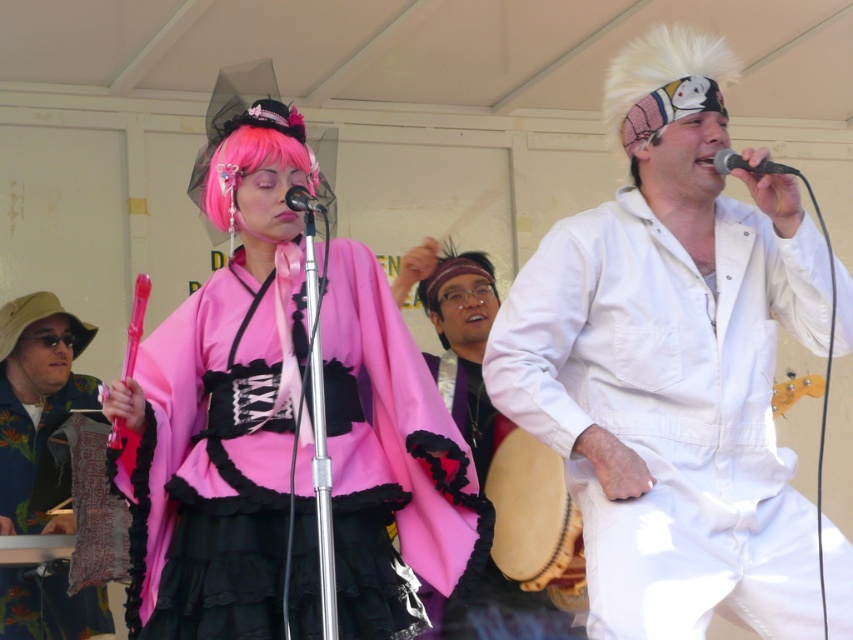
Looking at this image, which is above, light brown wooden drum at lower center or matte black microphone at center?

matte black microphone at center is above.

Measure the distance between point (518,435) and camera.

Point (518,435) is 18.86 feet from camera.

Identify the location of light brown wooden drum at lower center. The width and height of the screenshot is (853, 640). (534, 516).

Is the position of matte pink kimono at center more distant than that of black metallic microphone at upper right?

Yes.

Between matte pink kimono at center and black metallic microphone at upper right, which one appears on the left side from the viewer's perspective?

matte pink kimono at center

Who is more forward, (206,209) or (787,172)?

Positioned in front is point (787,172).

This screenshot has height=640, width=853. I want to click on matte pink kimono at center, so click(227, 413).

Is matte white jumpsuit at center wider than textured fabric at left?

In fact, matte white jumpsuit at center might be narrower than textured fabric at left.

Is point (512, 632) closer to camera compared to point (1, 596)?

Yes, point (512, 632) is in front of point (1, 596).

Image resolution: width=853 pixels, height=640 pixels. What do you see at coordinates (457, 339) in the screenshot? I see `matte white jumpsuit at center` at bounding box center [457, 339].

Where is `matte white jumpsuit at center`? Image resolution: width=853 pixels, height=640 pixels. matte white jumpsuit at center is located at coordinates (457, 339).